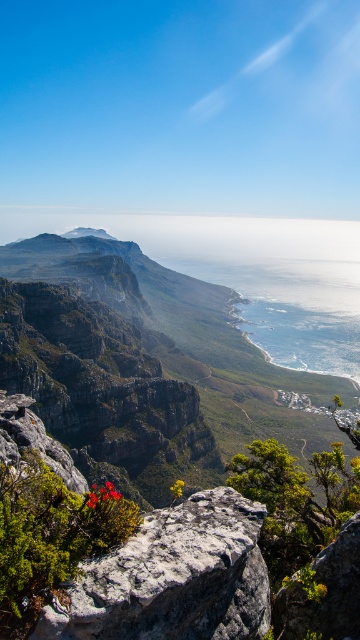
Question: Which object appears farthest from the camera in this image?

Choices:
 (A) gray rough rock at center
 (B) bright red flower at center
 (C) matte gray rock at center
 (D) blue liquid water at center

Answer: (C)

Question: Can you confirm if blue liquid water at center is positioned to the right of matte gray rock at center?

Choices:
 (A) yes
 (B) no

Answer: (A)

Question: Can you confirm if blue liquid water at center is wider than bright red flower at center?

Choices:
 (A) no
 (B) yes

Answer: (B)

Question: Which point is closer to the camera?

Choices:
 (A) gray rough rock at center
 (B) matte gray rock at center
 (C) bright red flower at center

Answer: (A)

Question: Among these objects, which one is nearest to the camera?

Choices:
 (A) gray rough rock at center
 (B) blue liquid water at center
 (C) bright red flower at center

Answer: (A)

Question: Can you confirm if bright red flower at center is wider than matte gray rock at center?

Choices:
 (A) yes
 (B) no

Answer: (B)